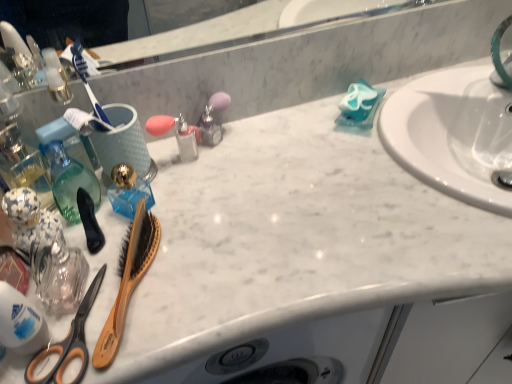
At what (x,y) coordinates should I click in order to perform the action: click on spots to the right of translucent plastic bottle at lower left, which is counted as the 2th cleaning product, starting from the right. Please return your answer as a coordinate pair (x, y). Looking at the image, I should click on (192, 296).